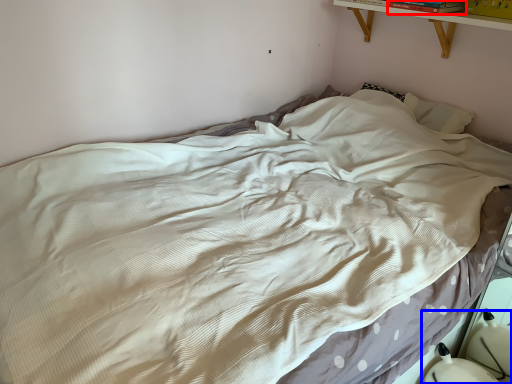
Question: Which object appears closest to the camera in this image, book (highlighted by a red box) or swivel chair (highlighted by a blue box)?

Choices:
 (A) book
 (B) swivel chair

Answer: (B)